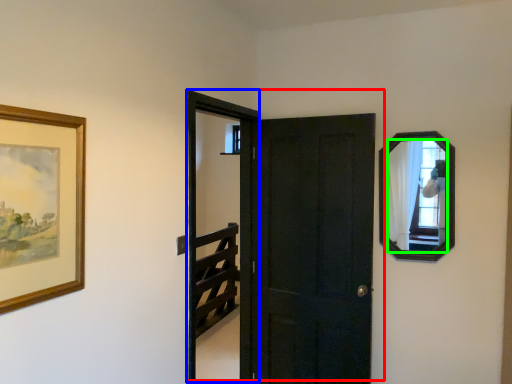
Question: Which object is positioned farthest from door (highlighted by a red box)? Select from screen door (highlighted by a blue box) and mirror (highlighted by a green box).

Choices:
 (A) screen door
 (B) mirror

Answer: (B)